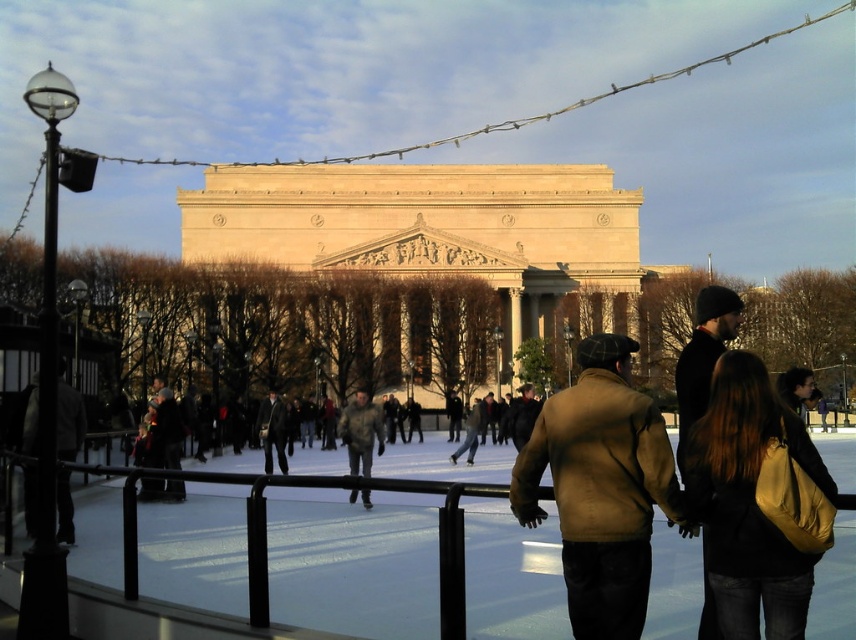
Does point (217, 524) lie in front of point (262, 445)?

That is True.

Between white ice skating rink at center and dark gray suit at center, which one has less height?

Standing shorter between the two is dark gray suit at center.

Is point (682, 620) farther from viewer compared to point (270, 451)?

That is False.

You are a GUI agent. You are given a task and a screenshot of the screen. Output one action in this format:
    pyautogui.click(x=<x>, y=<y>)
    Task: Click on the white ice skating rink at center
    
    Given the screenshot: What is the action you would take?
    pyautogui.click(x=354, y=563)

Does white ice skating rink at center have a larger size compared to brown leather jacket at center?

Yes.

Does white ice skating rink at center lie in front of brown leather jacket at center?

Yes, white ice skating rink at center is in front of brown leather jacket at center.

Between point (176, 536) and point (699, 305), which one is positioned behind?

Positioned behind is point (699, 305).

I want to click on white ice skating rink at center, so click(x=354, y=563).

Is beige stone building at center to the left of camouflage jacket at center from the viewer's perspective?

No, beige stone building at center is not to the left of camouflage jacket at center.

Who is taller, beige stone building at center or camouflage jacket at center?

Answer: Standing taller between the two is beige stone building at center.

The image size is (856, 640). I want to click on beige stone building at center, so click(432, 228).

Find the location of a particular element. This screenshot has width=856, height=640. beige stone building at center is located at coordinates (432, 228).